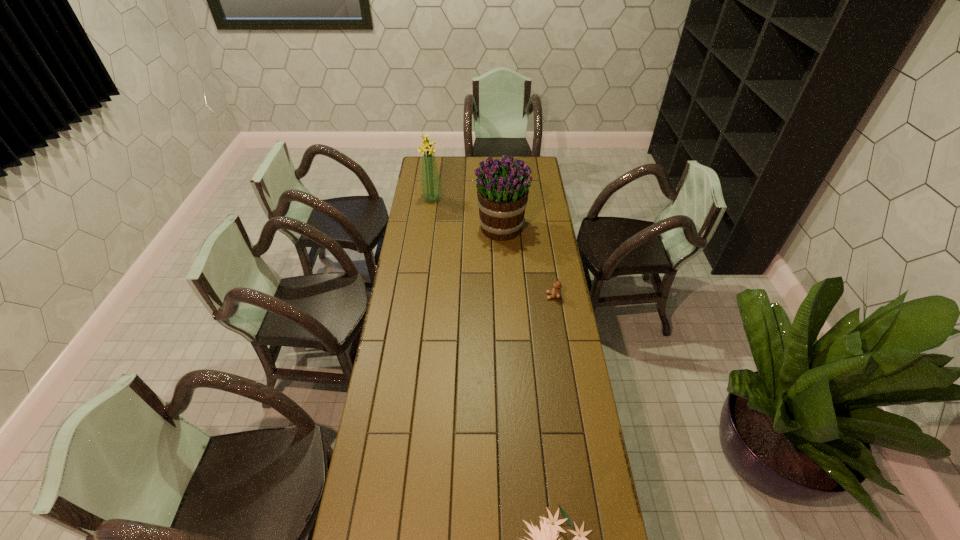
Locate an element on the screen. The height and width of the screenshot is (540, 960). vacant region between the second farthest bouquet and the leftmost bouquet is located at coordinates (467, 213).

At what (x,y) coordinates should I click in order to perform the action: click on free space between the shortest object and the third nearest object. Please return your answer as a coordinate pair (x, y). The width and height of the screenshot is (960, 540). Looking at the image, I should click on click(527, 262).

At what (x,y) coordinates should I click in order to perform the action: click on object that is the second closest to the leftmost bouquet. Please return your answer as a coordinate pair (x, y). This screenshot has height=540, width=960. Looking at the image, I should click on (556, 292).

Locate an element on the screen. object that stands as the third closest to the leftmost bouquet is located at coordinates (546, 539).

Locate which bouquet is the third closest to the shortest object. Please provide its 2D coordinates. Your answer should be formatted as a tuple, i.e. [(x, y)], where the tuple contains the x and y coordinates of a point satisfying the conditions above.

[(431, 191)]

Image resolution: width=960 pixels, height=540 pixels. I want to click on bouquet that stands as the closest to the third nearest object, so click(x=431, y=191).

The height and width of the screenshot is (540, 960). I want to click on vacant space that satisfies the following two spatial constraints: 1. on the front-facing side of the leftmost object; 2. on the right side of the third nearest object, so click(x=428, y=228).